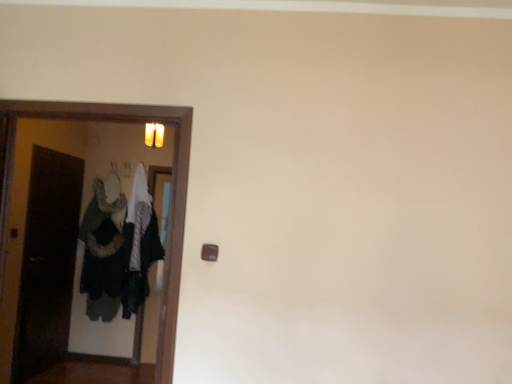
Question: Considering their positions, is dark gray fuzzy coat at left located in front of or behind wooden door at left?

Choices:
 (A) front
 (B) behind

Answer: (B)

Question: Considering the positions of dark gray fuzzy coat at left and wooden door at left in the image, is dark gray fuzzy coat at left taller or shorter than wooden door at left?

Choices:
 (A) short
 (B) tall

Answer: (B)

Question: Considering the positions of point (126, 289) and point (159, 114), is point (126, 289) closer or farther from the camera than point (159, 114)?

Choices:
 (A) closer
 (B) farther

Answer: (B)

Question: Considering the positions of wooden door at left and dark gray fuzzy coat at left in the image, is wooden door at left taller or shorter than dark gray fuzzy coat at left?

Choices:
 (A) short
 (B) tall

Answer: (A)

Question: Does point (7, 142) appear closer or farther from the camera than point (144, 228)?

Choices:
 (A) farther
 (B) closer

Answer: (B)

Question: From a real-world perspective, relative to dark gray fuzzy coat at left, is wooden door at left vertically above or below?

Choices:
 (A) below
 (B) above

Answer: (B)

Question: Visually, is wooden door at left positioned to the left or to the right of dark gray fuzzy coat at left?

Choices:
 (A) right
 (B) left

Answer: (A)